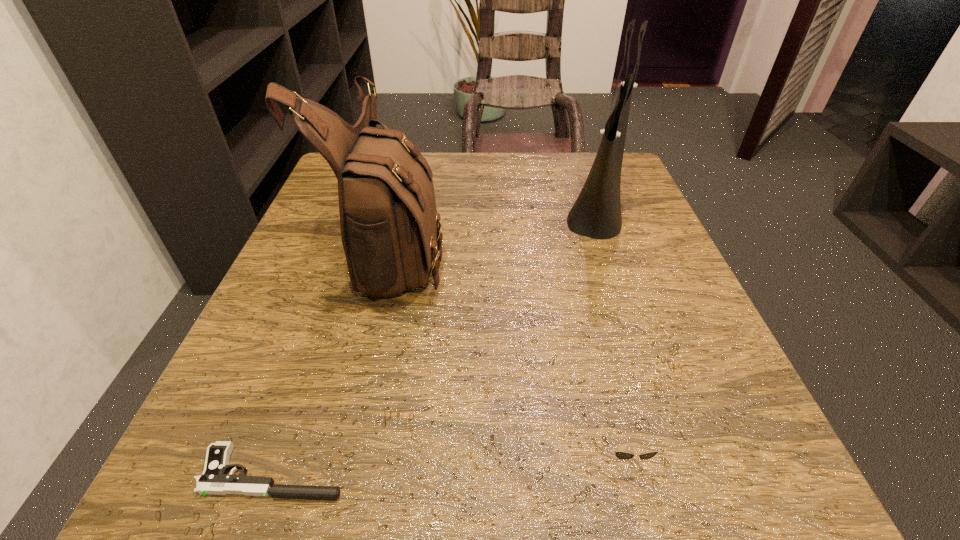
Identify the location of free area in between the second shortest object and the left shoulder bag. The image size is (960, 540). (509, 352).

Locate an element on the screen. This screenshot has width=960, height=540. object that is the second closest one to the sunglasses is located at coordinates (389, 222).

In order to click on object identified as the second closest to the second shortest object in this screenshot , I will do `click(389, 222)`.

Where is `free point that satisfies the following two spatial constraints: 1. on the front side of the right shoulder bag; 2. on the front-facing side of the left shoulder bag`? This screenshot has width=960, height=540. free point that satisfies the following two spatial constraints: 1. on the front side of the right shoulder bag; 2. on the front-facing side of the left shoulder bag is located at coordinates (612, 251).